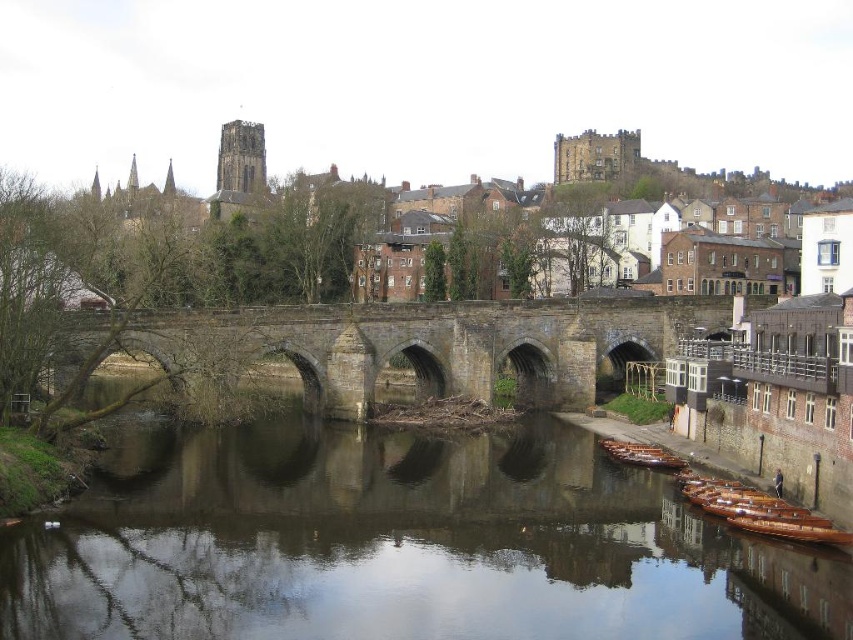
Question: Is smooth brown water at center thinner than stone arch bridge at center?

Choices:
 (A) yes
 (B) no

Answer: (A)

Question: Estimate the real-world distances between objects in this image. Which object is closer to the brown stone bridge at center?

Choices:
 (A) stone arch bridge at center
 (B) smooth brown water at center
 (C) wooden polished boats at lower right

Answer: (A)

Question: Where is stone arch bridge at center located in relation to wooden polished boats at lower right in the image?

Choices:
 (A) above
 (B) below

Answer: (A)

Question: Which point is closer to the camera taking this photo?

Choices:
 (A) (378, 285)
 (B) (842, 534)
 (C) (316, 532)

Answer: (B)

Question: Which object is closer to the camera taking this photo?

Choices:
 (A) brown stone bridge at center
 (B) smooth brown water at center
 (C) stone arch bridge at center

Answer: (B)

Question: Is smooth brown water at center wider than wooden polished boats at lower right?

Choices:
 (A) no
 (B) yes

Answer: (B)